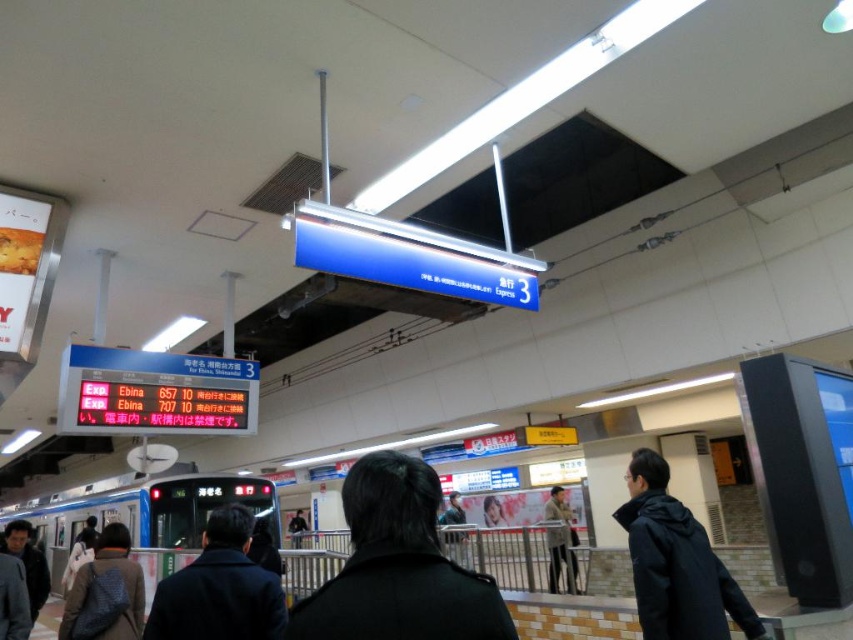
Question: Does dark gray jacket at lower right have a greater width compared to dark brown leather jacket at lower left?

Choices:
 (A) yes
 (B) no

Answer: (A)

Question: Which of the following is the closest to the observer?

Choices:
 (A) (703, 564)
 (B) (120, 547)
 (C) (224, 596)
 (D) (422, 586)

Answer: (D)

Question: Does black coat at center have a lesser width compared to dark blue coat at center?

Choices:
 (A) no
 (B) yes

Answer: (B)

Question: Among these points, which one is farthest from the camera?

Choices:
 (A) (378, 589)
 (B) (212, 611)

Answer: (B)

Question: Does black coat at center appear on the right side of dark brown leather jacket at lower left?

Choices:
 (A) yes
 (B) no

Answer: (A)

Question: Which is nearer to the dark gray jacket at lower right?

Choices:
 (A) dark brown leather jacket at lower left
 (B) dark blue coat at center

Answer: (B)